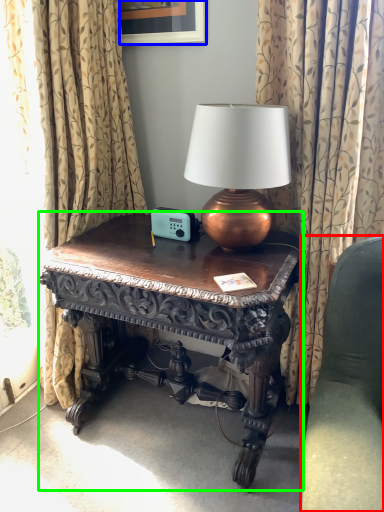
Question: Considering the real-world distances, which object is farthest from studio couch (highlighted by a red box)? picture frame (highlighted by a blue box) or table (highlighted by a green box)?

Choices:
 (A) picture frame
 (B) table

Answer: (A)